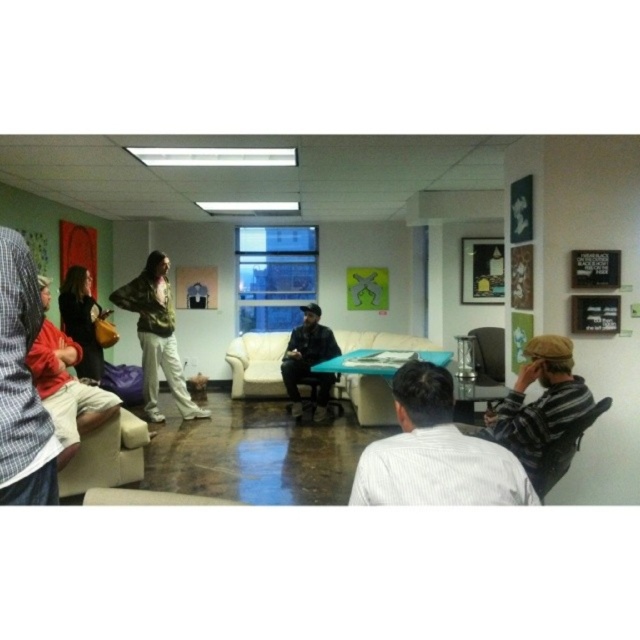
Can you confirm if striped cotton shirt at right is positioned to the right of black leather chair at lower right?

Incorrect, striped cotton shirt at right is not on the right side of black leather chair at lower right.

Between point (541, 348) and point (561, 440), which one is positioned in front?

Point (561, 440)

This screenshot has width=640, height=640. I want to click on striped cotton shirt at right, so click(538, 403).

Can you confirm if plaid shirt at left is positioned above striped cotton shirt at right?

Correct, plaid shirt at left is located above striped cotton shirt at right.

Between point (0, 440) and point (506, 438), which one is positioned behind?

The point (506, 438) is more distant.

This screenshot has height=640, width=640. I want to click on plaid shirt at left, so click(20, 385).

Which is behind, point (301, 346) or point (490, 384)?

Point (301, 346)

You are a GUI agent. You are given a task and a screenshot of the screen. Output one action in this format:
    pyautogui.click(x=<x>, y=<y>)
    Task: Click on the dark blue jeans at center
    Image resolution: width=640 pixels, height=640 pixels.
    Given the screenshot: What is the action you would take?
    (308, 358)

The image size is (640, 640). What do you see at coordinates (308, 358) in the screenshot?
I see `dark blue jeans at center` at bounding box center [308, 358].

At what (x,y) coordinates should I click in order to perform the action: click on dark blue jeans at center. Please return your answer as a coordinate pair (x, y). The height and width of the screenshot is (640, 640). Looking at the image, I should click on (308, 358).